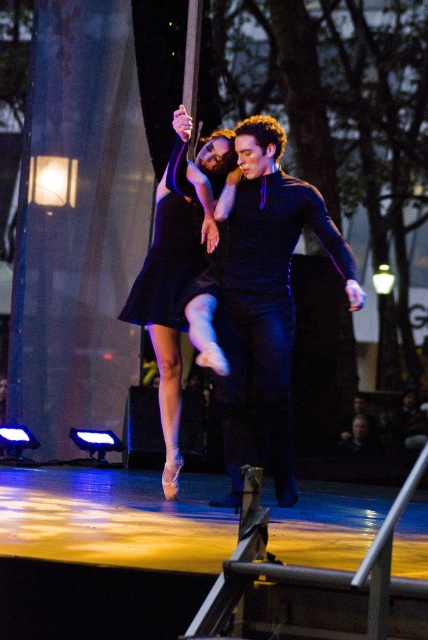
Question: Which is farther from the matte black dress at center?

Choices:
 (A) black satin dress at center
 (B) dark blue sweater at center

Answer: (B)

Question: Based on their relative distances, which object is farther from the black satin dress at center?

Choices:
 (A) matte black dress at center
 (B) dark blue sweater at center

Answer: (B)

Question: Observing the image, what is the correct spatial positioning of matte black dress at center in reference to black satin dress at center?

Choices:
 (A) right
 (B) left

Answer: (B)

Question: Can you confirm if dark blue sweater at center is positioned to the right of black satin dress at center?

Choices:
 (A) no
 (B) yes

Answer: (B)

Question: Which of these objects is positioned closest to the matte black dress at center?

Choices:
 (A) dark blue sweater at center
 (B) black satin dress at center

Answer: (B)

Question: Is matte black dress at center smaller than black satin dress at center?

Choices:
 (A) yes
 (B) no

Answer: (B)